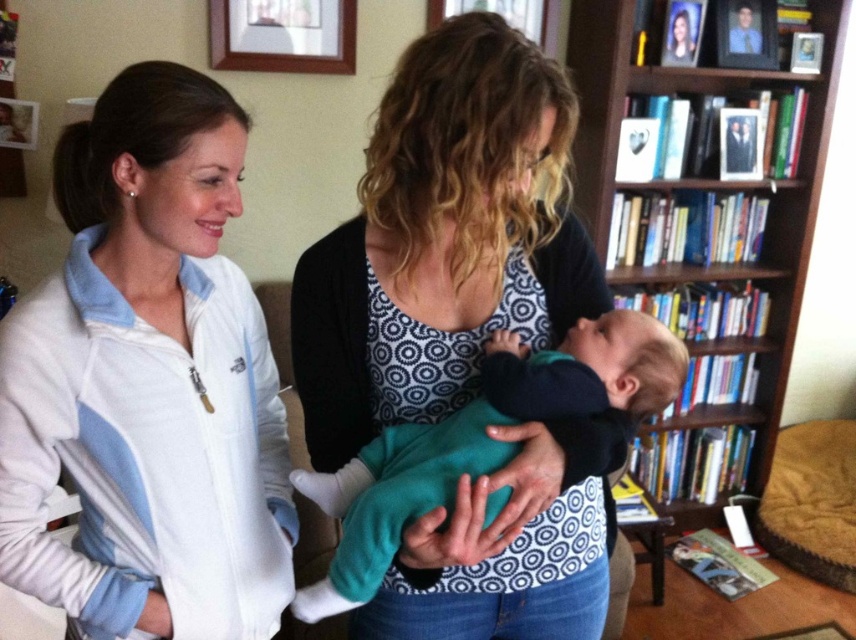
Question: Is the position of brown wooden bookcase at upper right less distant than that of wooden picture frame at upper center?

Choices:
 (A) no
 (B) yes

Answer: (B)

Question: Based on their relative distances, which object is nearer to the matte blue tank top at center?

Choices:
 (A) teal fleece baby at center
 (B) brown wooden bookcase at upper right
 (C) matte blue photo frame at upper right
 (D) wooden picture frame at upper center

Answer: (A)

Question: Can you confirm if matte blue tank top at center is bigger than brown wooden bookcase at upper right?

Choices:
 (A) no
 (B) yes

Answer: (A)

Question: Which is farther from the brown wooden bookcase at upper right?

Choices:
 (A) white fleece jacket at left
 (B) wooden picture frame at upper center

Answer: (A)

Question: Which object is farther from the camera taking this photo?

Choices:
 (A) matte blue tank top at center
 (B) white fleece jacket at left

Answer: (B)

Question: Can you confirm if brown wooden bookcase at upper right is smaller than wooden picture frame at upper center?

Choices:
 (A) no
 (B) yes

Answer: (A)